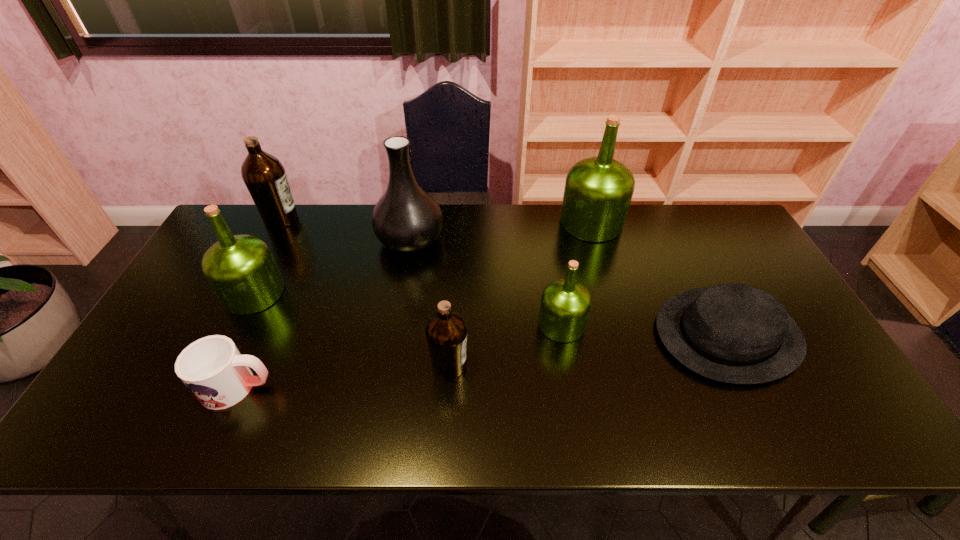
The width and height of the screenshot is (960, 540). I want to click on empty space between the leftmost green olive oil and the biggest green olive oil, so click(422, 258).

Where is `unoccupied area between the farther brown olive oil and the nearest olive oil`? The image size is (960, 540). unoccupied area between the farther brown olive oil and the nearest olive oil is located at coordinates (365, 292).

Find the location of a particular element. free area in between the mug and the nearer brown olive oil is located at coordinates (344, 376).

The width and height of the screenshot is (960, 540). I want to click on unoccupied position between the biggest green olive oil and the right brown olive oil, so click(x=520, y=294).

The image size is (960, 540). I want to click on vacant area that lies between the smallest green olive oil and the black fedora, so click(x=644, y=329).

Where is `free point between the mug and the smallest green olive oil`? The height and width of the screenshot is (540, 960). free point between the mug and the smallest green olive oil is located at coordinates (399, 355).

At what (x,y) coordinates should I click in order to perform the action: click on vacant area that lies between the smallest green olive oil and the nearest olive oil. Please return your answer as a coordinate pair (x, y). Looking at the image, I should click on coord(505,345).

This screenshot has height=540, width=960. Find the location of `object that can be found as the closest to the third olive oil from left to right`. object that can be found as the closest to the third olive oil from left to right is located at coordinates (565, 306).

The height and width of the screenshot is (540, 960). What are the coordinates of `object that can be found as the second closest to the vase` in the screenshot? It's located at (264, 175).

Where is `the second closest olive oil to the mug`? This screenshot has height=540, width=960. the second closest olive oil to the mug is located at coordinates (446, 332).